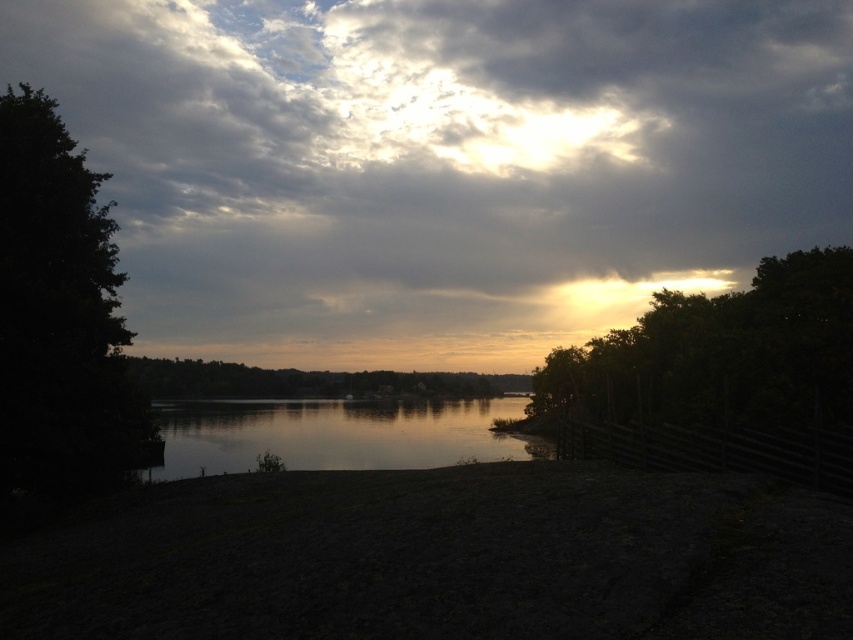
Question: Which of these objects is positioned farthest from the silvery metallic tree at upper right?

Choices:
 (A) green matte tree at center
 (B) cloudy sky at upper center
 (C) dark green leafy tree at left
 (D) silvery reflective water at center

Answer: (B)

Question: Is silvery metallic tree at upper right to the right of silvery reflective water at center from the viewer's perspective?

Choices:
 (A) yes
 (B) no

Answer: (A)

Question: Does silvery reflective water at center have a lesser width compared to green matte tree at center?

Choices:
 (A) yes
 (B) no

Answer: (A)

Question: Which object is closer to the camera taking this photo?

Choices:
 (A) green matte tree at center
 (B) silvery metallic tree at upper right
 (C) silvery reflective water at center
 (D) dark green leafy tree at left

Answer: (B)

Question: Is silvery metallic tree at upper right below silvery reflective water at center?

Choices:
 (A) no
 (B) yes

Answer: (A)

Question: Which is farther from the dark green leafy tree at left?

Choices:
 (A) silvery metallic tree at upper right
 (B) green matte tree at center
 (C) cloudy sky at upper center

Answer: (C)